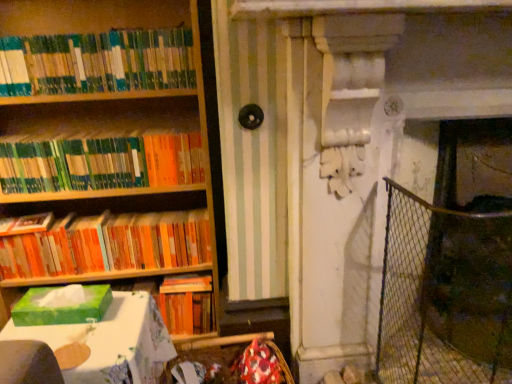
Describe the element at coordinates (111, 342) in the screenshot. I see `green cardboard tissue box at lower left` at that location.

Identify the location of green matte bookshelf at upper left, acting as the 2th book starting from the bottom. Image resolution: width=512 pixels, height=384 pixels. (102, 163).

Image resolution: width=512 pixels, height=384 pixels. I want to click on green cardboard tissue box at lower left, so click(111, 342).

Where is `book that is behind the green matte bookshelf at upper left, the 2th book in the top-to-bottom sequence`? book that is behind the green matte bookshelf at upper left, the 2th book in the top-to-bottom sequence is located at coordinates (109, 244).

Between orange matte bookshelf at left, which ranks as the 3th book in top-to-bottom order, and green matte bookshelf at upper left, the 2th book in the top-to-bottom sequence, which one has larger width?

orange matte bookshelf at left, which ranks as the 3th book in top-to-bottom order, is wider.

Measure the distance between orange matte bookshelf at left, which ranks as the 3th book in top-to-bottom order, and green matte bookshelf at upper left, the 2th book in the top-to-bottom sequence.

9.00 inches.

Which is behind, orange matte bookshelf at left, which ranks as the 3th book in top-to-bottom order, or green matte bookshelf at upper left, acting as the 2th book starting from the bottom?

orange matte bookshelf at left, which ranks as the 3th book in top-to-bottom order, is further away from the camera.

Is wire mesh fence at right bigger or smaller than green matte bookshelf at upper left, the third book in the bottom-to-top sequence?

Considering their sizes, wire mesh fence at right takes up more space than green matte bookshelf at upper left, the third book in the bottom-to-top sequence.

Can you see wire mesh fence at right touching green matte bookshelf at upper left, the third book in the bottom-to-top sequence?

There is a gap between wire mesh fence at right and green matte bookshelf at upper left, the third book in the bottom-to-top sequence.

In the image, is wire mesh fence at right positioned in front of or behind green matte bookshelf at upper left, the 1th book in the top-to-bottom sequence?

Visually, wire mesh fence at right is located behind green matte bookshelf at upper left, the 1th book in the top-to-bottom sequence.

Which of these two, wire mesh fence at right or green matte bookshelf at upper left, the third book in the bottom-to-top sequence, is wider?

wire mesh fence at right is wider.

In the scene shown: Could you measure the distance between green matte bookshelf at upper left, the 1th book in the top-to-bottom sequence, and wire mesh fence at right?

The distance of green matte bookshelf at upper left, the 1th book in the top-to-bottom sequence, from wire mesh fence at right is 3.34 feet.

Looking at this image, does green matte bookshelf at upper left, the third book in the bottom-to-top sequence, have a lesser width compared to wire mesh fence at right?

Yes, green matte bookshelf at upper left, the third book in the bottom-to-top sequence, is thinner than wire mesh fence at right.

Is green matte bookshelf at upper left, the third book in the bottom-to-top sequence, positioned with its back to wire mesh fence at right?

No, green matte bookshelf at upper left, the third book in the bottom-to-top sequence, is not facing the opposite direction of wire mesh fence at right.

Considering the relative sizes of green matte bookshelf at upper left, the 1th book in the top-to-bottom sequence, and green matte tissue box at left in the image provided, is green matte bookshelf at upper left, the 1th book in the top-to-bottom sequence, taller than green matte tissue box at left?

Correct, green matte bookshelf at upper left, the 1th book in the top-to-bottom sequence, is much taller as green matte tissue box at left.

In terms of size, does green matte bookshelf at upper left, the 1th book in the top-to-bottom sequence, appear bigger or smaller than green matte tissue box at left?

green matte bookshelf at upper left, the 1th book in the top-to-bottom sequence, is bigger than green matte tissue box at left.

In the scene shown: Which is more to the left, green matte bookshelf at upper left, the third book in the bottom-to-top sequence, or green matte tissue box at left?

Positioned to the left is green matte bookshelf at upper left, the third book in the bottom-to-top sequence.

From the image's perspective, is green matte bookshelf at upper left, the third book in the bottom-to-top sequence, above or below green matte tissue box at left?

Clearly, from the image's perspective, green matte bookshelf at upper left, the third book in the bottom-to-top sequence, is above green matte tissue box at left.

From a real-world perspective, does orange matte bookshelf at left, which ranks as the 3th book in top-to-bottom order, sit lower than green cardboard tissue box at lower left?

No, from a real-world perspective, orange matte bookshelf at left, which ranks as the 3th book in top-to-bottom order, is not under green cardboard tissue box at lower left.

How different are the orientations of orange matte bookshelf at left, positioned as the 1th book in bottom-to-top order, and green cardboard tissue box at lower left in degrees?

orange matte bookshelf at left, positioned as the 1th book in bottom-to-top order, and green cardboard tissue box at lower left are facing 87.9 degrees away from each other.

Does orange matte bookshelf at left, which ranks as the 3th book in top-to-bottom order, have a lesser width compared to green cardboard tissue box at lower left?

Yes, orange matte bookshelf at left, which ranks as the 3th book in top-to-bottom order, is thinner than green cardboard tissue box at lower left.

Is green cardboard tissue box at lower left completely or partially inside orange matte bookshelf at left, which ranks as the 3th book in top-to-bottom order?

No, orange matte bookshelf at left, which ranks as the 3th book in top-to-bottom order, does not contain green cardboard tissue box at lower left.

Is wire mesh fence at right thinner than green cardboard tissue box at lower left?

Indeed, wire mesh fence at right has a lesser width compared to green cardboard tissue box at lower left.

From the image's perspective, does wire mesh fence at right appear higher than green cardboard tissue box at lower left?

Yes.

From a real-world perspective, between wire mesh fence at right and green cardboard tissue box at lower left, who is vertically lower?

In real-world perspective, green cardboard tissue box at lower left is lower.

Is wire mesh fence at right to the right of green cardboard tissue box at lower left from the viewer's perspective?

Indeed, wire mesh fence at right is positioned on the right side of green cardboard tissue box at lower left.

Is wire mesh fence at right aimed at green matte tissue box at left?

No.

Looking at this image, from the image's perspective, who appears lower, wire mesh fence at right or green matte tissue box at left?

green matte tissue box at left is shown below in the image.

Consider the image. Is wire mesh fence at right wider or thinner than green matte tissue box at left?

wire mesh fence at right is wider than green matte tissue box at left.

Identify the location of book located below the green matte bookshelf at upper left, acting as the 2th book starting from the bottom (from the image's perspective). The width and height of the screenshot is (512, 384). (109, 244).

From the image's perspective, which book is the 3rd one above the wire mesh fence at right? Please provide its 2D coordinates.

[(97, 62)]

Estimate the real-world distances between objects in this image. Which object is closer to green cardboard tissue box at lower left, orange matte bookshelf at left, which ranks as the 3th book in top-to-bottom order, or green matte bookshelf at upper left, the 2th book in the top-to-bottom sequence?

Based on the image, orange matte bookshelf at left, which ranks as the 3th book in top-to-bottom order, appears to be nearer to green cardboard tissue box at lower left.

From the image, which object appears to be farther from green matte bookshelf at upper left, acting as the 2th book starting from the bottom, green cardboard tissue box at lower left or orange matte bookshelf at left, positioned as the 1th book in bottom-to-top order?

green cardboard tissue box at lower left is positioned further to the anchor green matte bookshelf at upper left, acting as the 2th book starting from the bottom.

Considering their positions, is green matte bookshelf at upper left, acting as the 2th book starting from the bottom, positioned further to green matte tissue box at left than orange matte bookshelf at left, positioned as the 1th book in bottom-to-top order?

The object further to green matte tissue box at left is green matte bookshelf at upper left, acting as the 2th book starting from the bottom.

Which object lies further to the anchor point green matte tissue box at left, wire mesh fence at right or orange matte bookshelf at left, which ranks as the 3th book in top-to-bottom order?

Based on the image, wire mesh fence at right appears to be further to green matte tissue box at left.

Based on their spatial positions, is green cardboard tissue box at lower left or green matte bookshelf at upper left, the third book in the bottom-to-top sequence, further from orange matte bookshelf at left, positioned as the 1th book in bottom-to-top order?

green matte bookshelf at upper left, the third book in the bottom-to-top sequence, lies further to orange matte bookshelf at left, positioned as the 1th book in bottom-to-top order, than the other object.

Considering their positions, is wire mesh fence at right positioned closer to orange matte bookshelf at left, which ranks as the 3th book in top-to-bottom order, than green matte tissue box at left?

The object closer to orange matte bookshelf at left, which ranks as the 3th book in top-to-bottom order, is green matte tissue box at left.

Based on their spatial positions, is wire mesh fence at right or green matte bookshelf at upper left, the 2th book in the top-to-bottom sequence, closer to orange matte bookshelf at left, which ranks as the 3th book in top-to-bottom order?

Among the two, green matte bookshelf at upper left, the 2th book in the top-to-bottom sequence, is located nearer to orange matte bookshelf at left, which ranks as the 3th book in top-to-bottom order.

From the image, which object appears to be nearer to orange matte bookshelf at left, positioned as the 1th book in bottom-to-top order, green matte bookshelf at upper left, the third book in the bottom-to-top sequence, or green matte tissue box at left?

green matte tissue box at left.

Where is `paperback book located between green matte bookshelf at upper left, the third book in the bottom-to-top sequence, and wire mesh fence at right in the left-right direction`? Image resolution: width=512 pixels, height=384 pixels. paperback book located between green matte bookshelf at upper left, the third book in the bottom-to-top sequence, and wire mesh fence at right in the left-right direction is located at coordinates (62, 305).

At what (x,y) coordinates should I click in order to perform the action: click on paperback book located between orange matte bookshelf at left, positioned as the 1th book in bottom-to-top order, and wire mesh fence at right in the left-right direction. Please return your answer as a coordinate pair (x, y). This screenshot has height=384, width=512. Looking at the image, I should click on (62, 305).

Where is `book that lies between green matte bookshelf at upper left, the third book in the bottom-to-top sequence, and orange matte bookshelf at left, which ranks as the 3th book in top-to-bottom order, from top to bottom`? The height and width of the screenshot is (384, 512). book that lies between green matte bookshelf at upper left, the third book in the bottom-to-top sequence, and orange matte bookshelf at left, which ranks as the 3th book in top-to-bottom order, from top to bottom is located at coordinates (102, 163).

The width and height of the screenshot is (512, 384). I want to click on paperback book that lies between green matte bookshelf at upper left, the third book in the bottom-to-top sequence, and green cardboard tissue box at lower left from top to bottom, so click(62, 305).